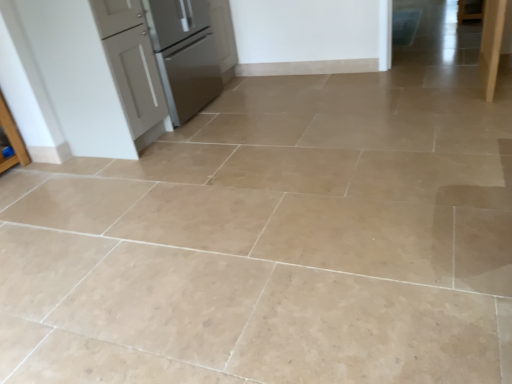
This screenshot has height=384, width=512. Describe the element at coordinates (184, 55) in the screenshot. I see `satin stainless steel refrigerator at upper left` at that location.

The width and height of the screenshot is (512, 384). In order to click on satin stainless steel refrigerator at upper left in this screenshot , I will do `click(184, 55)`.

This screenshot has width=512, height=384. I want to click on satin stainless steel refrigerator at upper left, so click(x=184, y=55).